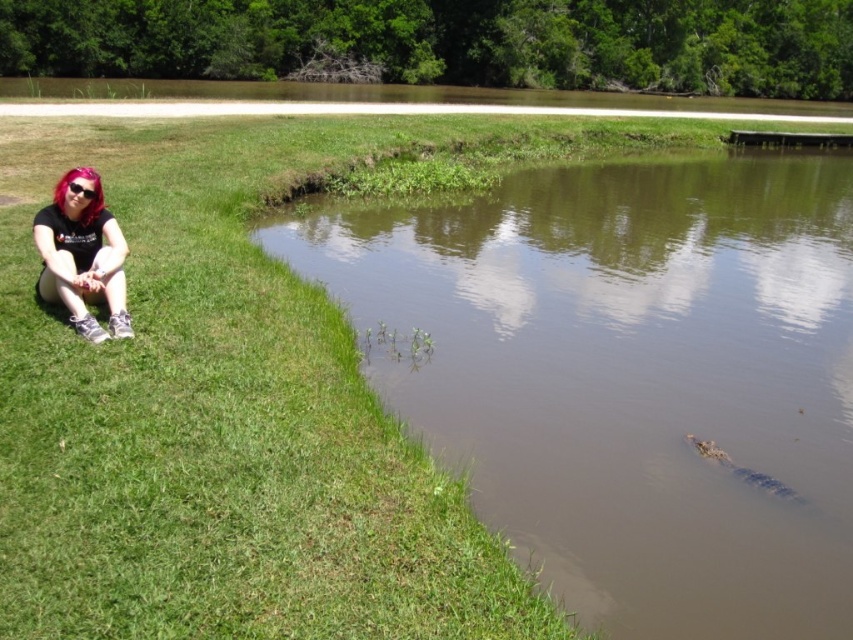
You are standing at the edge of the water and want to reach the point marked at coordinates point (83,246). Given that you can walk 25 feet in 10 seconds, how long will it take you to reach that point?

The distance between you and point (83,246) is 24.61 feet. Since you can walk 25 feet in 10 seconds, it will take approximately 10 seconds to reach the point.

You are a photographer trying to capture the person in the scene. Since the matte black hair at lower left and sunglasses at left are both visible, can you tell which one is covering the person eyes?

The matte black hair at lower left is positioned under sunglasses at left, so the sunglasses at left are covering the person eyes.

You are a photographer trying to capture the reflection of the sky in the brown muddy water at lower left and the matte black hair at lower left. Since you want to focus on the reflection, which object should you position closer to the camera to ensure the reflection is sharp?

The brown muddy water at lower left is in front of the matte black hair at lower left, so positioning the camera closer to the brown muddy water at lower left will ensure the reflection in it is sharp.